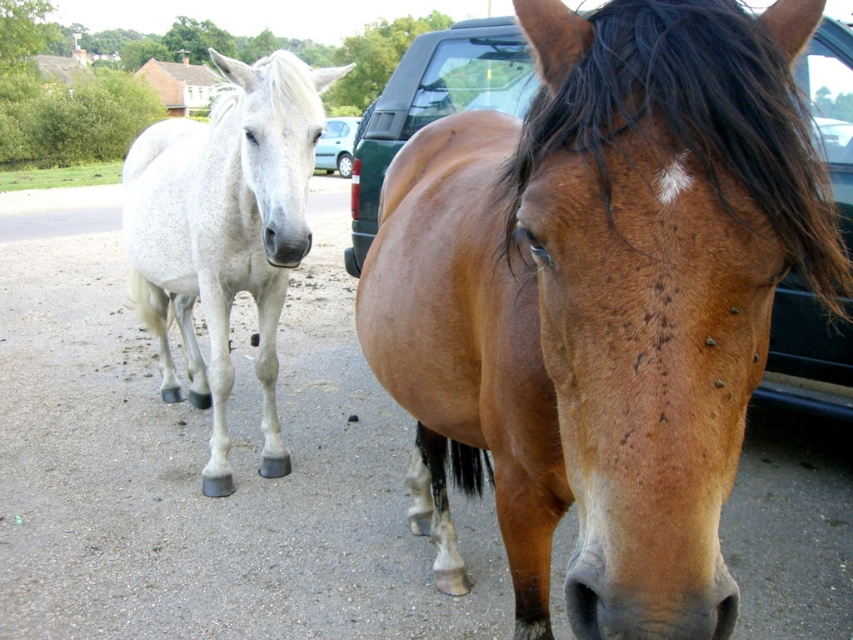
Question: Which point is farther from the camera taking this photo?

Choices:
 (A) (328, 131)
 (B) (241, 131)
 (C) (444, 173)
 (D) (775, 156)

Answer: (A)

Question: Is brown shiny horse at center positioned behind white glossy horse at left?

Choices:
 (A) yes
 (B) no

Answer: (B)

Question: Which of the following is the farthest from the observer?

Choices:
 (A) (221, 488)
 (B) (589, 106)
 (C) (805, 248)

Answer: (A)

Question: Which point is closer to the camera taking this photo?

Choices:
 (A) (323, 144)
 (B) (824, 195)

Answer: (B)

Question: Observing the image, what is the correct spatial positioning of brown silky mane at center in reference to white glossy horse at left?

Choices:
 (A) above
 (B) below

Answer: (B)

Question: Is the position of white glossy horse at left less distant than that of metallic silver car at center?

Choices:
 (A) no
 (B) yes

Answer: (B)